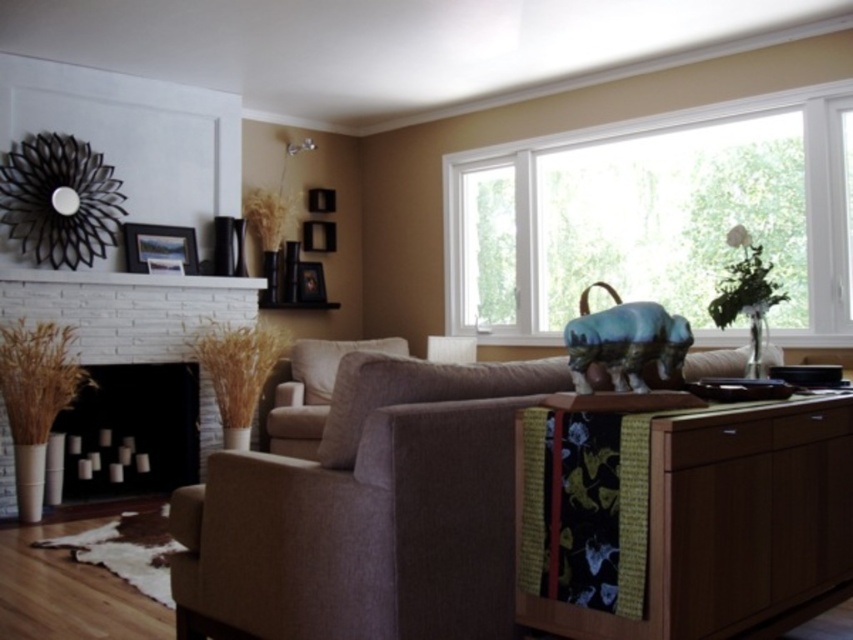
Between white brick fireplace at left and wooden picture frame at upper center, which one has more height?

white brick fireplace at left is taller.

Which is more to the left, white brick fireplace at left or wooden picture frame at upper center?

white brick fireplace at left is more to the left.

The height and width of the screenshot is (640, 853). I want to click on white brick fireplace at left, so (126, 308).

Is wooden cabinet at right shorter than black matte fireplace at center?

Indeed, wooden cabinet at right has a lesser height compared to black matte fireplace at center.

Which of these two, wooden cabinet at right or black matte fireplace at center, stands shorter?

wooden cabinet at right

Describe the element at coordinates (683, 518) in the screenshot. The width and height of the screenshot is (853, 640). I see `wooden cabinet at right` at that location.

This screenshot has height=640, width=853. I want to click on wooden cabinet at right, so click(x=683, y=518).

Is white glossy window at upper right shorter than wooden picture frame at upper left?

In fact, white glossy window at upper right may be taller than wooden picture frame at upper left.

Describe the element at coordinates (651, 214) in the screenshot. This screenshot has height=640, width=853. I see `white glossy window at upper right` at that location.

The height and width of the screenshot is (640, 853). What do you see at coordinates (651, 214) in the screenshot?
I see `white glossy window at upper right` at bounding box center [651, 214].

Where is `white glossy window at upper right`? Image resolution: width=853 pixels, height=640 pixels. white glossy window at upper right is located at coordinates (651, 214).